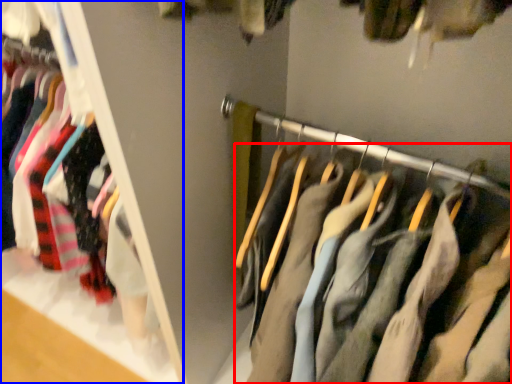
Question: Among these objects, which one is farthest to the camera, trousers (highlighted by a red box) or closet (highlighted by a blue box)?

Choices:
 (A) trousers
 (B) closet

Answer: (B)